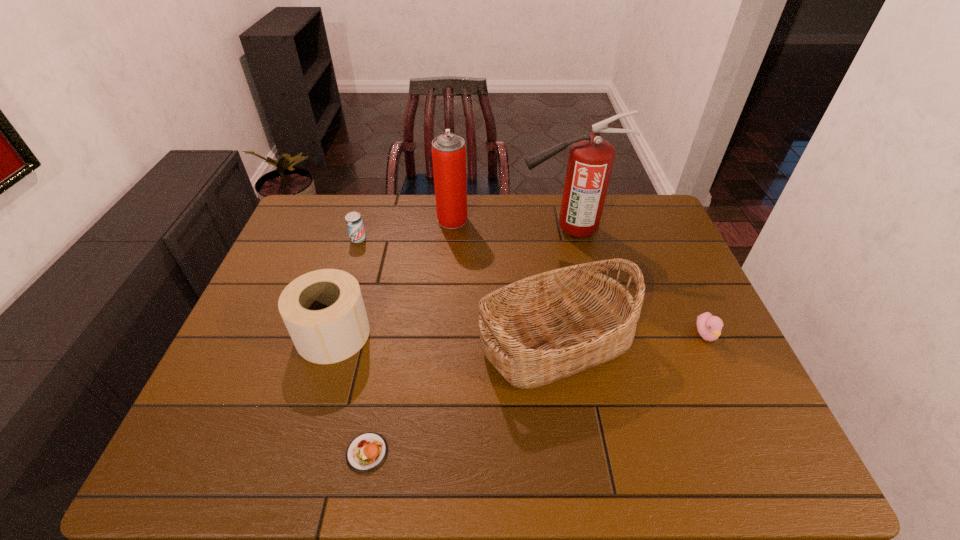
This screenshot has width=960, height=540. I want to click on vacant point located between the fourth object from right to left and the tallest object, so click(x=510, y=225).

The image size is (960, 540). Identify the location of vacant area between the rightmost object and the patty (food). (537, 394).

The height and width of the screenshot is (540, 960). Find the location of `empty space that is in between the fifth shortest object and the nearest object`. empty space that is in between the fifth shortest object and the nearest object is located at coordinates 461,396.

The height and width of the screenshot is (540, 960). In order to click on vacant region between the patty (food) and the sixth tallest object in this screenshot , I will do `click(537, 394)`.

Where is `unoccupied area between the basket and the fourth object from left to right`? The width and height of the screenshot is (960, 540). unoccupied area between the basket and the fourth object from left to right is located at coordinates 504,280.

At what (x,y) coordinates should I click in order to perform the action: click on free area in between the fire extinguisher and the fourth tallest object. Please return your answer as a coordinate pair (x, y). The image size is (960, 540). Looking at the image, I should click on (450, 282).

Find the location of a particular element. The height and width of the screenshot is (540, 960). free space that is in between the tallest object and the patty (food) is located at coordinates (468, 341).

The height and width of the screenshot is (540, 960). I want to click on the sixth closest object to the fourth object from right to left, so click(709, 327).

Where is `object that is the fifth nearest to the fifth shortest object`? object that is the fifth nearest to the fifth shortest object is located at coordinates (448, 150).